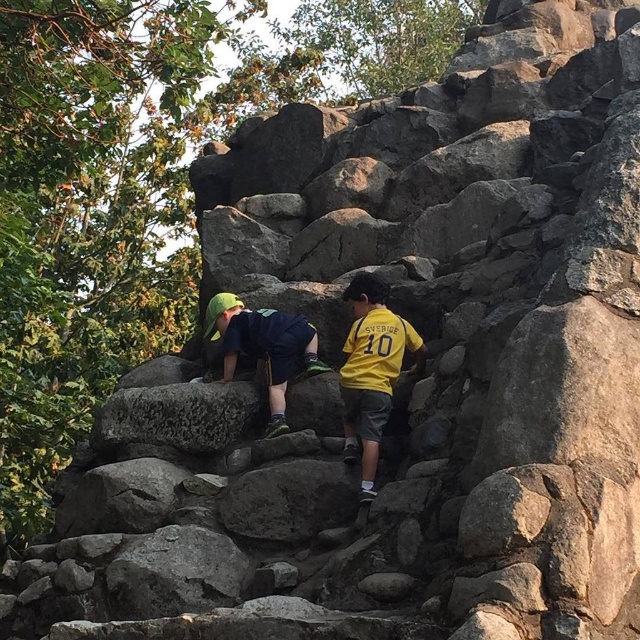
Between yellow jersey at center and green fabric shirt at upper center, which one has less height?

Standing shorter between the two is green fabric shirt at upper center.

Looking at this image, is the position of yellow jersey at center less distant than that of green fabric shirt at upper center?

Yes, it is.

Does point (360, 490) come closer to viewer compared to point (224, 296)?

Yes, it is in front of point (224, 296).

Identify the location of yellow jersey at center. (371, 371).